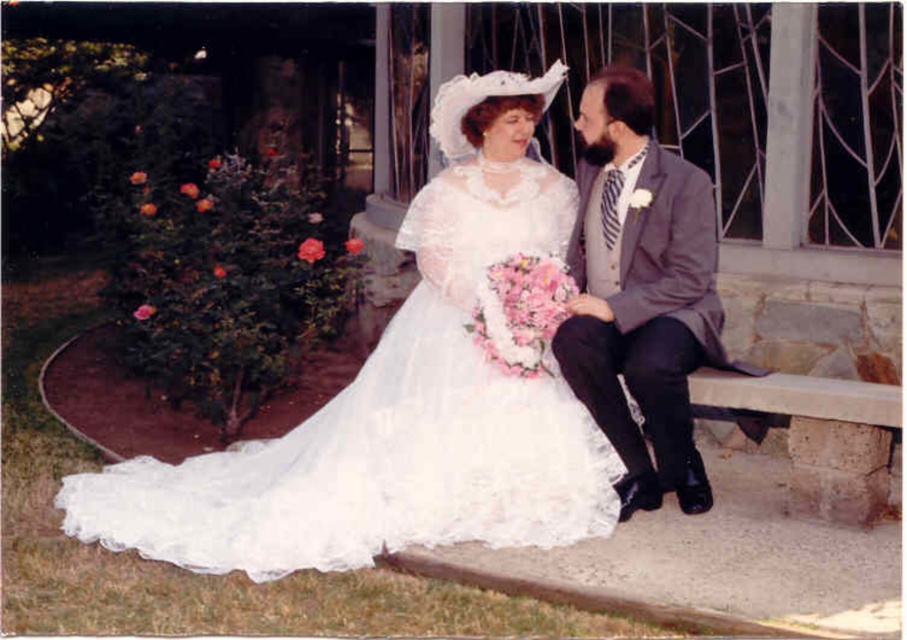
Can you confirm if white lace dress at center is positioned below gray wool suit at right?

Correct, white lace dress at center is located below gray wool suit at right.

Is white lace dress at center positioned behind gray wool suit at right?

No, it is in front of gray wool suit at right.

Is point (392, 538) closer to camera compared to point (673, 205)?

That is True.

Locate an element on the screen. The image size is (907, 640). white lace dress at center is located at coordinates (391, 428).